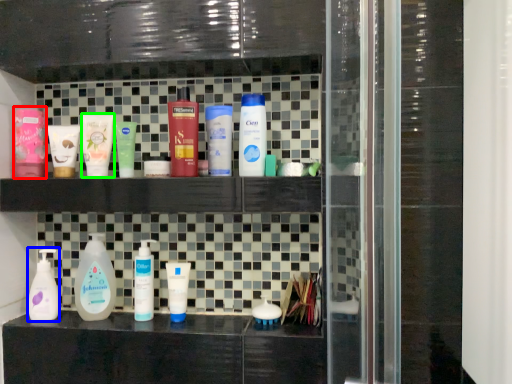
Question: Which object is positioned farthest from toiletry (highlighted by a red box)? Select from cleaning product (highlighted by a blue box) and mouthwash (highlighted by a green box).

Choices:
 (A) cleaning product
 (B) mouthwash

Answer: (A)